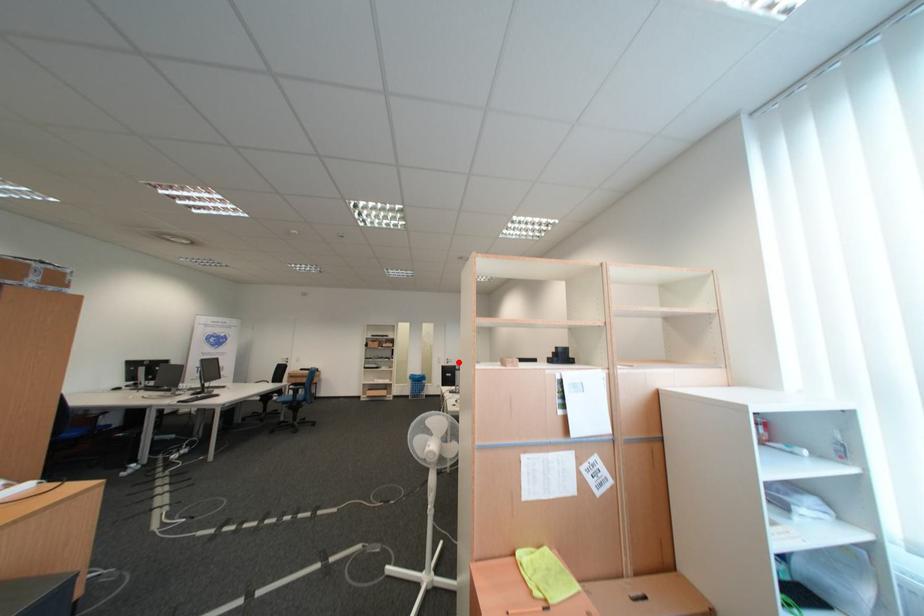
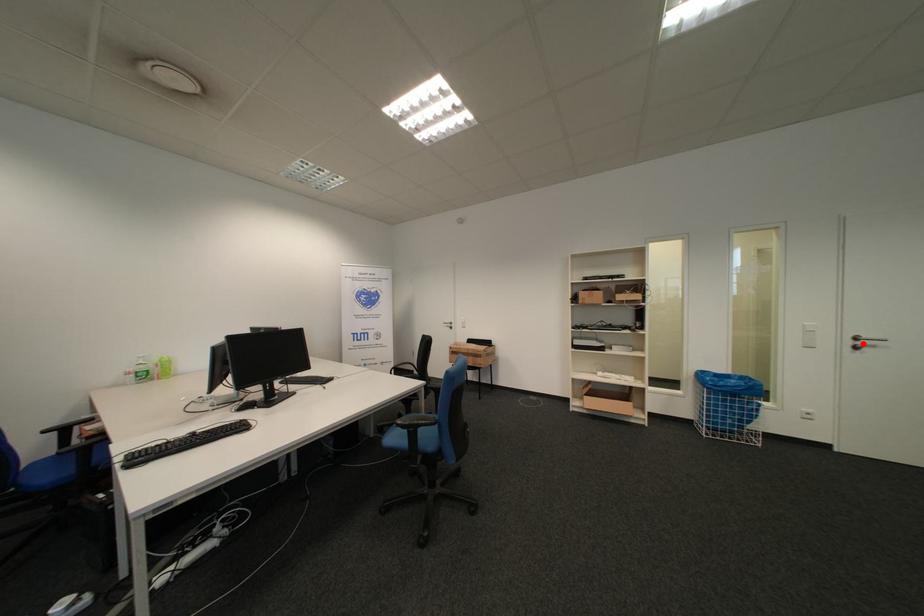
I am providing you with two images of the same scene from different viewpoints. A red point is marked on the first image and another point is marked on the second image. Do the highlighted points in image1 and image2 indicate the same real-world spot?

Yes